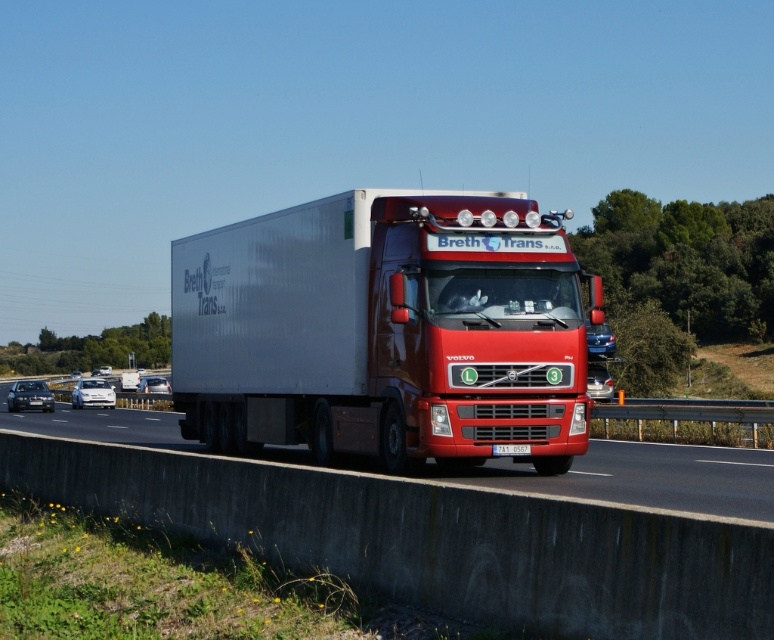
Question: Among these objects, which one is nearest to the camera?

Choices:
 (A) black plastic license plate at center
 (B) metallic gray highway at center
 (C) metallic silver trailer at center

Answer: (B)

Question: Based on their relative distances, which object is farther from the metallic silver trailer at center?

Choices:
 (A) black plastic license plate at center
 (B) metallic gray highway at center

Answer: (B)

Question: Does metallic silver trailer at center have a larger size compared to metallic gray highway at center?

Choices:
 (A) no
 (B) yes

Answer: (A)

Question: Observing the image, what is the correct spatial positioning of metallic silver trailer at center in reference to metallic gray highway at center?

Choices:
 (A) right
 (B) left

Answer: (A)

Question: Can you confirm if metallic silver trailer at center is wider than metallic gray highway at center?

Choices:
 (A) yes
 (B) no

Answer: (B)

Question: Considering the real-world distances, which object is closest to the black plastic license plate at center?

Choices:
 (A) metallic silver trailer at center
 (B) metallic gray highway at center

Answer: (A)